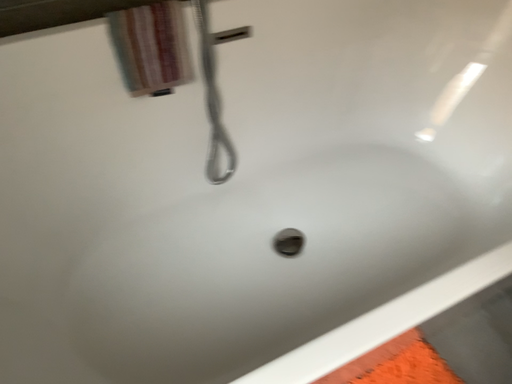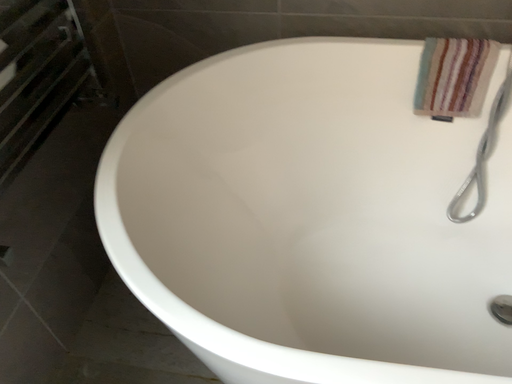
Question: Which way did the camera rotate in the video?

Choices:
 (A) rotated downward
 (B) rotated upward

Answer: (B)